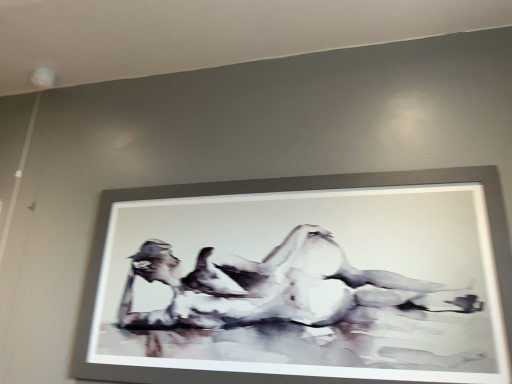
The width and height of the screenshot is (512, 384). What are the coordinates of `matte gray picture frame at center` in the screenshot? It's located at (302, 280).

Image resolution: width=512 pixels, height=384 pixels. What do you see at coordinates (302, 280) in the screenshot?
I see `matte gray picture frame at center` at bounding box center [302, 280].

At what (x,y) coordinates should I click in order to perform the action: click on matte gray picture frame at center. Please return your answer as a coordinate pair (x, y). The width and height of the screenshot is (512, 384). Looking at the image, I should click on (302, 280).